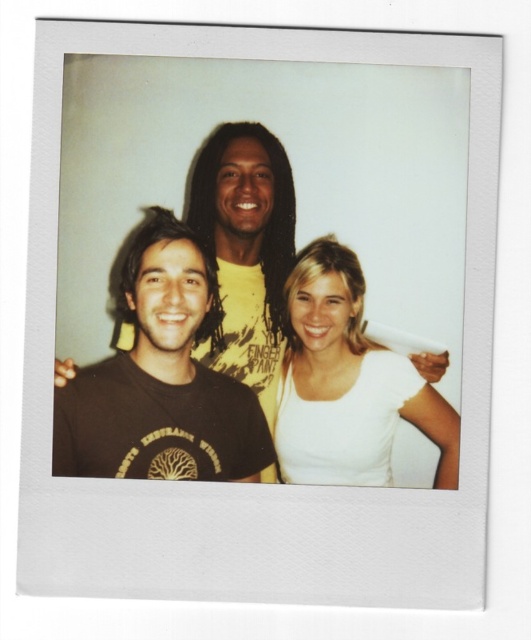
Based on the scene description, where is the white matte shirt at center located in terms of coordinates?

The white matte shirt at center is located at coordinates [346,381].

In the Polaroid photo, there are three people posing together. The person on the left is wearing a dark brown T shirt with a circular design, and the person in the center has a yellow T shirt with the text YOU FINGER PAINT. Now, there is a point at coordinates (346,381). Which object from the scene does this point correspond to?

The point at coordinates (346,381) corresponds to the white matte shirt at center.